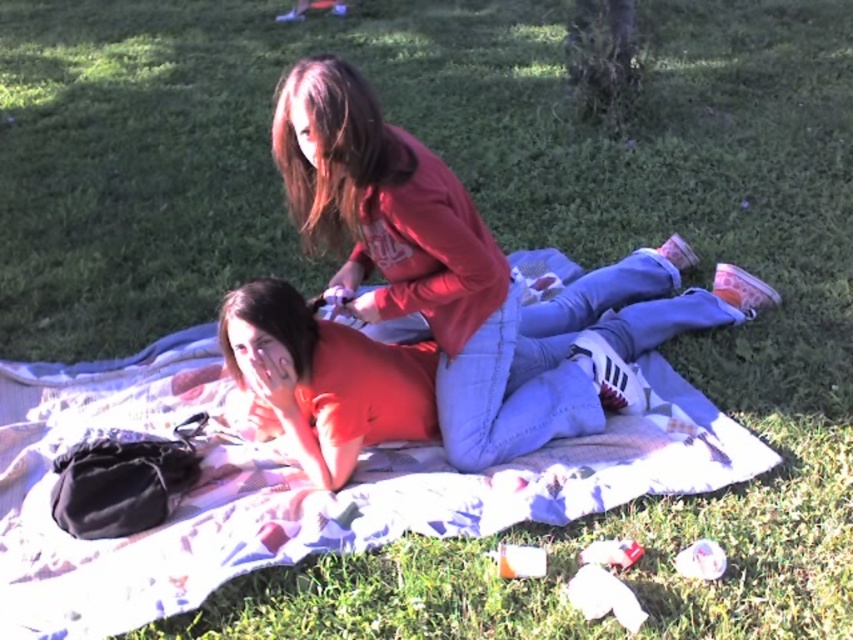
In the scene shown: You are standing in the outdoor scene and want to place a small snack on the white cotton blanket at center. To ensure it doesn not fall off, should you place it closer to the edge near the orange matte shirt at center or the opposite edge?

You should place the snack closer to the edge near the orange matte shirt at center because the white cotton blanket at center is positioned to the left of the orange matte shirt at center, meaning the blanket extends further away from the shirt. Placing the snack near the shirt side would keep it closer to the center of the blanket, reducing the chance of it sliding off.

You are planning to lay out a picnic setup using the items in the image. If you want to place both the white cotton blanket at center and the matte red shirt at center on the grass, which item should you place first to ensure there is enough space for both?

Since the white cotton blanket at center is larger in size than the matte red shirt at center, you should place the white cotton blanket at center first to ensure there is enough space for both items.